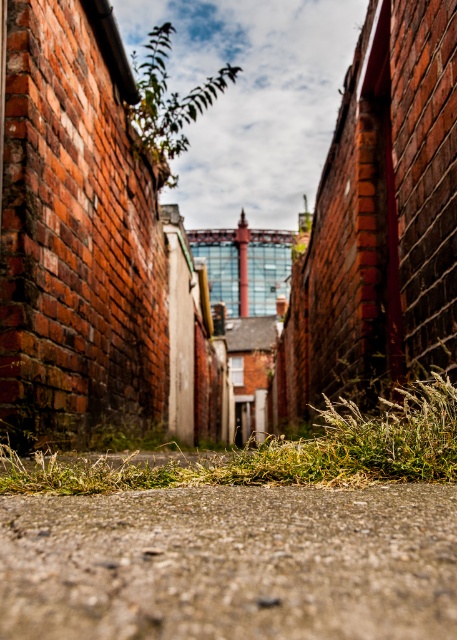
You are a delivery drone with a height of 12 inches. You are flying over the gray concrete ground at center. Can you safely hover without touching the ground?

The gray concrete ground at center and camera are 12.22 inches apart. Since the drone is 12 inches tall, there is enough space between the ground and the camera to safely hover without touching the ground.

You are a delivery robot with a height of 1.2 meters. You are in the alleyway and need to move forward. Is the gray concrete ground at center, represented by point (230, 563), passable for your robot?

The gray concrete ground at center is represented by point (230, 563), so yes, the robot can pass through it since it is part of the ground surface and the robot can navigate over concrete.

You are a delivery robot with a height of 12 inches. You are navigating through the narrow alleyway and need to reach the gray concrete ground at center. Based on the scene description, can you safely pass through without hitting your head?

The gray concrete ground at center and camera are 12.22 inches apart from each other. Since the robot is 12 inches tall, it can safely pass through as the clearance is sufficient.